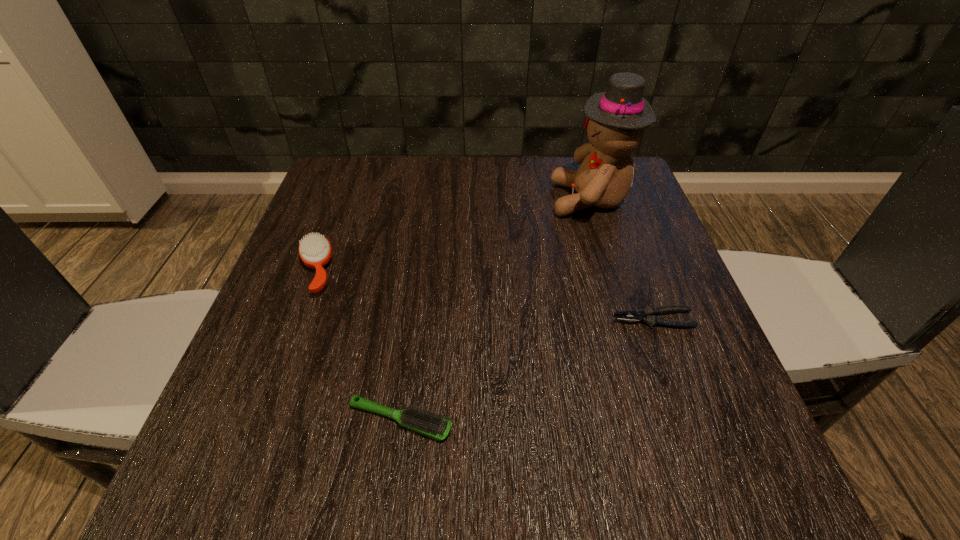
Where is `pliers present at the right edge`? pliers present at the right edge is located at coordinates (649, 315).

The image size is (960, 540). Find the location of `object positioned at the far right corner`. object positioned at the far right corner is located at coordinates (615, 119).

You are a GUI agent. You are given a task and a screenshot of the screen. Output one action in this format:
    pyautogui.click(x=<x>, y=<y>)
    Task: Click on the vacant space at the far edge
    This screenshot has width=960, height=540.
    Given the screenshot: What is the action you would take?
    pyautogui.click(x=537, y=190)

This screenshot has height=540, width=960. Find the location of `vacant space at the near edge of the desktop`. vacant space at the near edge of the desktop is located at coordinates (591, 478).

At what (x,y) coordinates should I click in order to perform the action: click on free space at the left edge. Please return your answer as a coordinate pair (x, y). Looking at the image, I should click on (314, 337).

I want to click on free spot at the right edge of the desktop, so click(x=634, y=338).

Identify the location of free space at the far left corner of the desktop. (390, 161).

In order to click on free space at the near left corner of the desktop in this screenshot , I will do `click(231, 494)`.

Identify the location of free spot at the far right corner of the desktop. The width and height of the screenshot is (960, 540). coord(577,166).

What are the coordinates of `vacant region between the taller hairbrush and the pliers` in the screenshot? It's located at (485, 295).